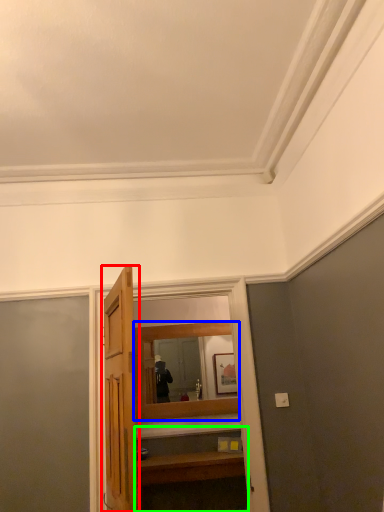
Question: Based on their relative distances, which object is farther from door (highlighted by a red box)? Choose from mirror (highlighted by a blue box) and vanity (highlighted by a green box).

Choices:
 (A) mirror
 (B) vanity

Answer: (A)